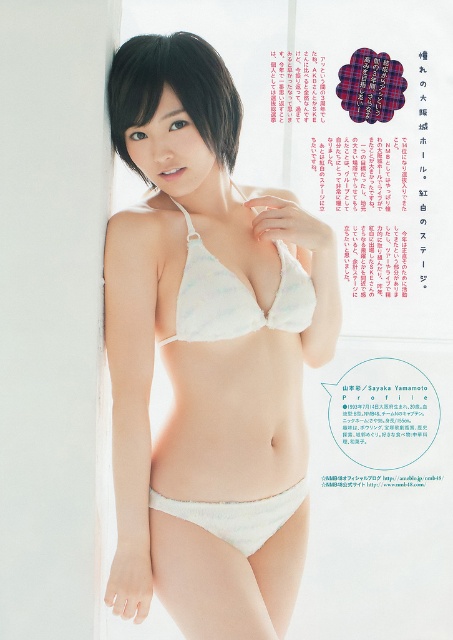
You are a photographer setting up a shoot. You need to place a light source at point 0.5, 0.5 to ensure even lighting. Will the light source be positioned to the left or right of the white matte lingerie at center?

The white matte lingerie at center is positioned at point (207, 355). The light source at (226, 320) has an x coordinate of 0.5, which is less than 0.555. Therefore, the light source will be positioned to the left of the white matte lingerie at center.

You are a photographer setting up a shoot. You need to ensure that the dark brown silky hair at upper center and the white lace bikini top at center are both visible in the frame. Based on their widths, which object should you adjust your camera focus on first to ensure proper framing?

The dark brown silky hair at upper center has a smaller width compared to the white lace bikini top at center, so you should focus on the white lace bikini top at center first to ensure it fits properly in the frame.